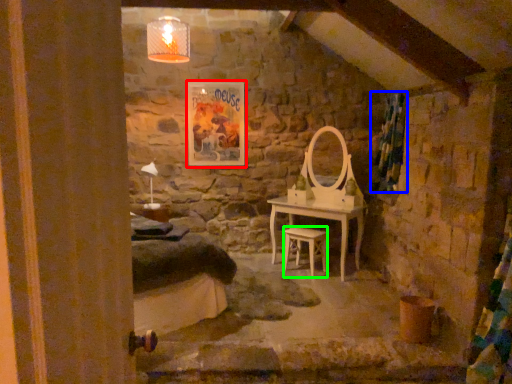
Question: Estimate the real-world distances between objects in this image. Which object is farther from picture frame (highlighted by a red box), curtain (highlighted by a blue box) or stool (highlighted by a green box)?

Choices:
 (A) curtain
 (B) stool

Answer: (A)